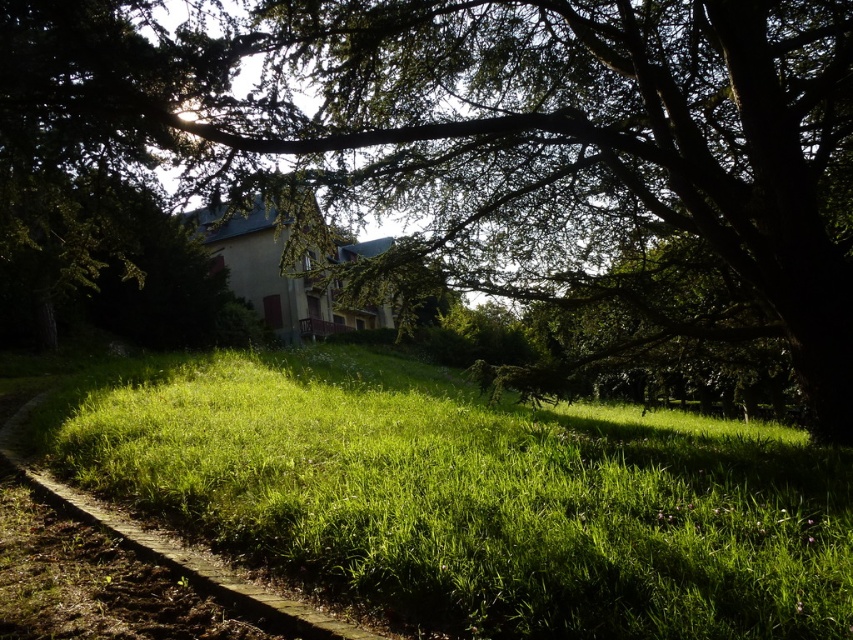
Is point (651, 157) more distant than point (149, 488)?

Yes, point (651, 157) is behind point (149, 488).

Locate an element on the screen. The width and height of the screenshot is (853, 640). green leafy tree at upper center is located at coordinates (508, 141).

Who is more forward, (351, 157) or (107, 419)?

Positioned in front is point (107, 419).

Where is `green leafy tree at upper center`? The image size is (853, 640). green leafy tree at upper center is located at coordinates (508, 141).